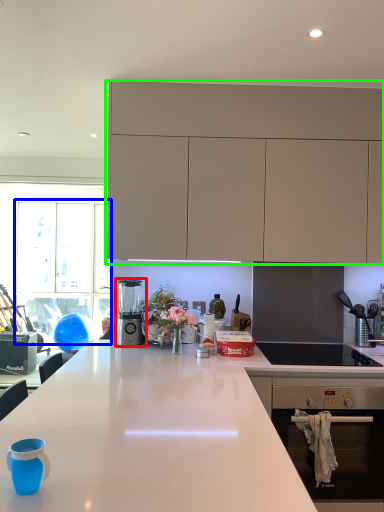
Question: Estimate the real-world distances between objects in this image. Which object is farther from kitchen appliance (highlighted by a red box), glass door (highlighted by a blue box) or cabinetry (highlighted by a green box)?

Choices:
 (A) glass door
 (B) cabinetry

Answer: (A)